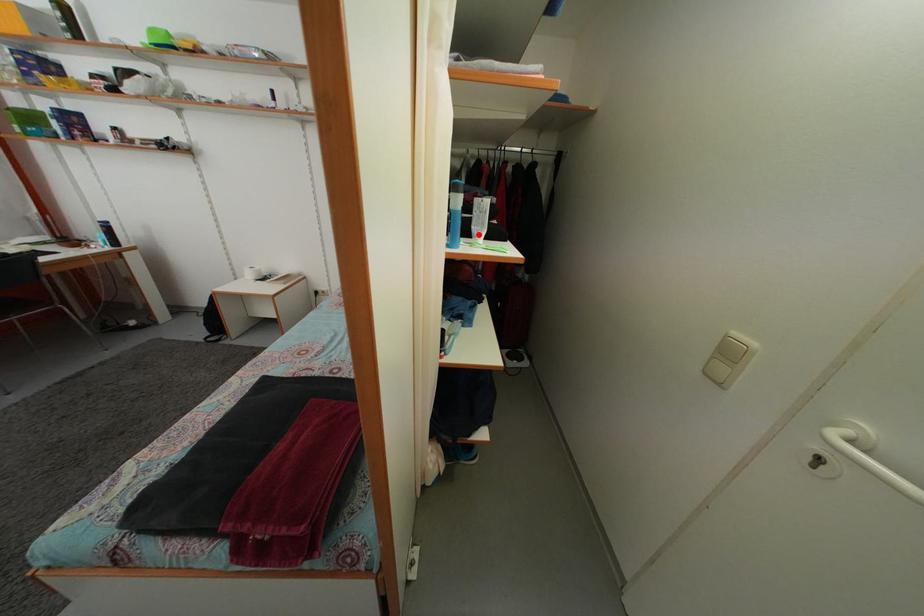
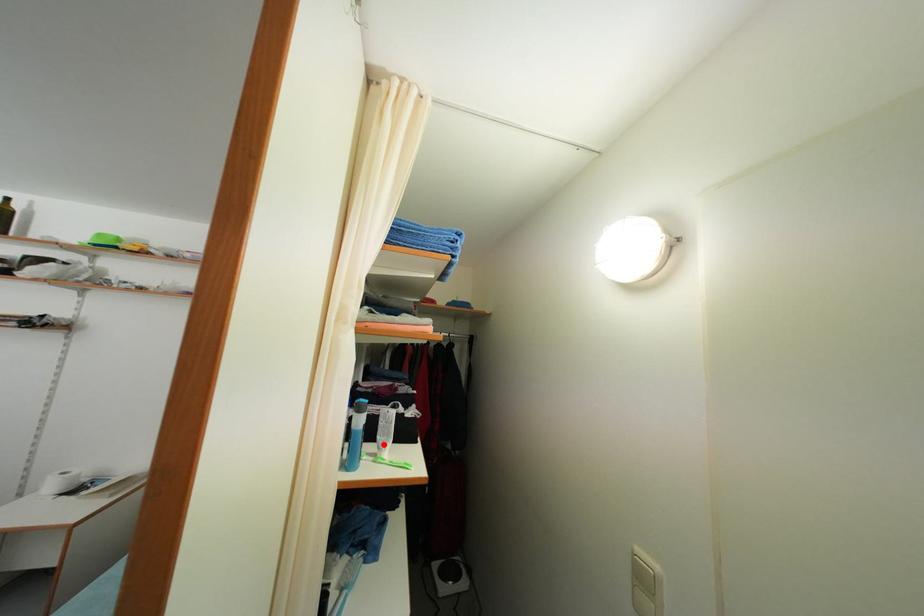
I am providing you with two images of the same scene from different viewpoints. A red point is marked on the first image and another point is marked on the second image. Is the red point in image1 aligned with the point shown in image2?

Yes